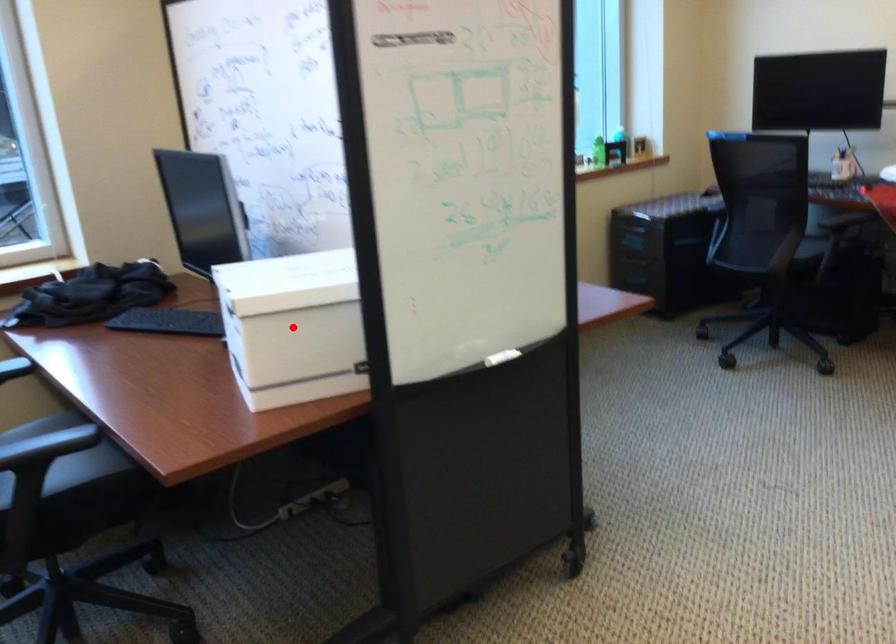
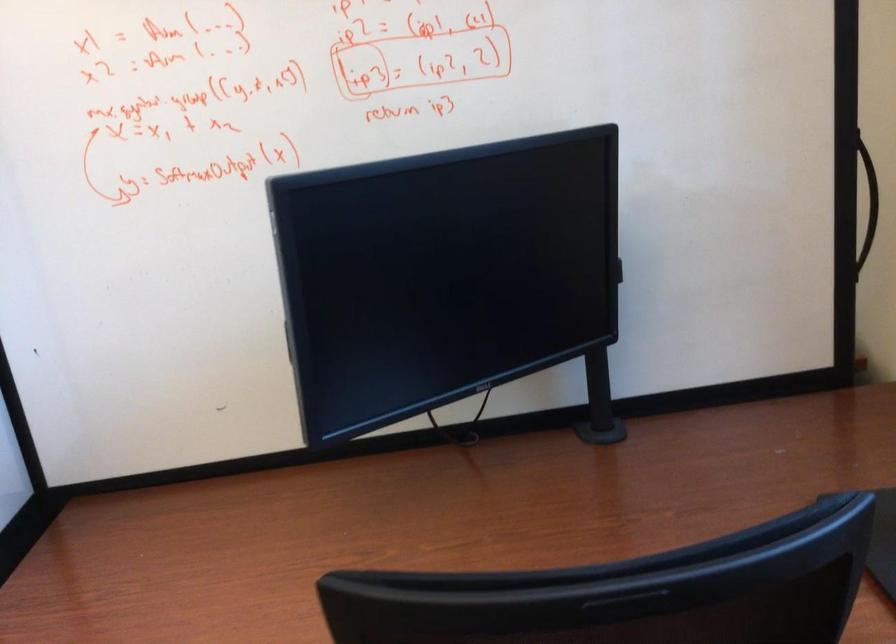
Question: I am providing you with two images of the same scene from different viewpoints. A red point is marked on the first image. Can you still see the location of the red point in image 2?

Choices:
 (A) Yes
 (B) No

Answer: (B)